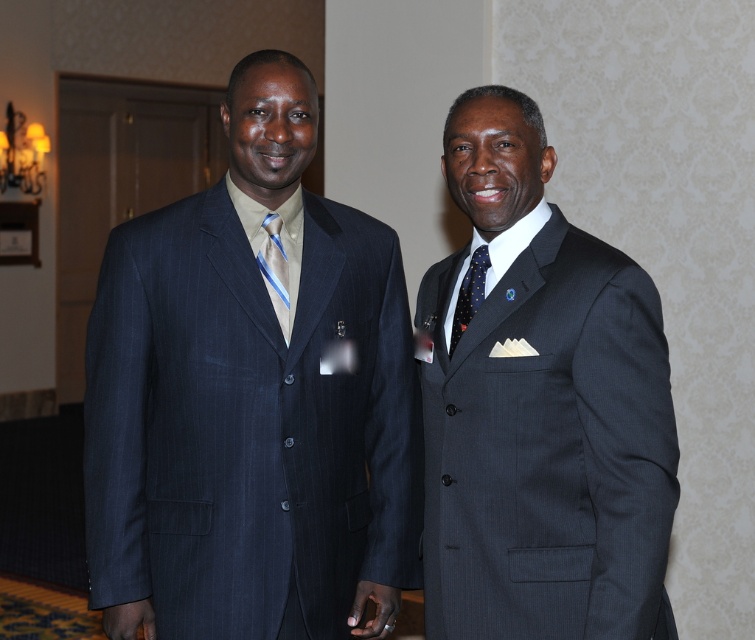
Does dark gray pinstripe suit at right have a larger size compared to dark blue dotted tie at right?

Yes, dark gray pinstripe suit at right is bigger than dark blue dotted tie at right.

Who is shorter, dark gray pinstripe suit at right or dark blue dotted tie at right?

With less height is dark blue dotted tie at right.

Is point (612, 502) positioned before point (464, 298)?

Yes, point (612, 502) is in front of point (464, 298).

Where is `dark gray pinstripe suit at right`? dark gray pinstripe suit at right is located at coordinates [541, 406].

Between dark gray pinstripe suit at right and blue striped tie at center, which one is positioned lower?

dark gray pinstripe suit at right is below.

Which is more to the right, dark gray pinstripe suit at right or blue striped tie at center?

Positioned to the right is dark gray pinstripe suit at right.

Who is more forward, (612, 339) or (267, 275)?

Positioned in front is point (612, 339).

Identify the location of dark gray pinstripe suit at right. (541, 406).

Is matte pinstripe suit at left wider than dark blue dotted tie at right?

Indeed, matte pinstripe suit at left has a greater width compared to dark blue dotted tie at right.

Does point (199, 246) come behind point (461, 305)?

Yes, it is.

Find the location of a particular element. matte pinstripe suit at left is located at coordinates (251, 401).